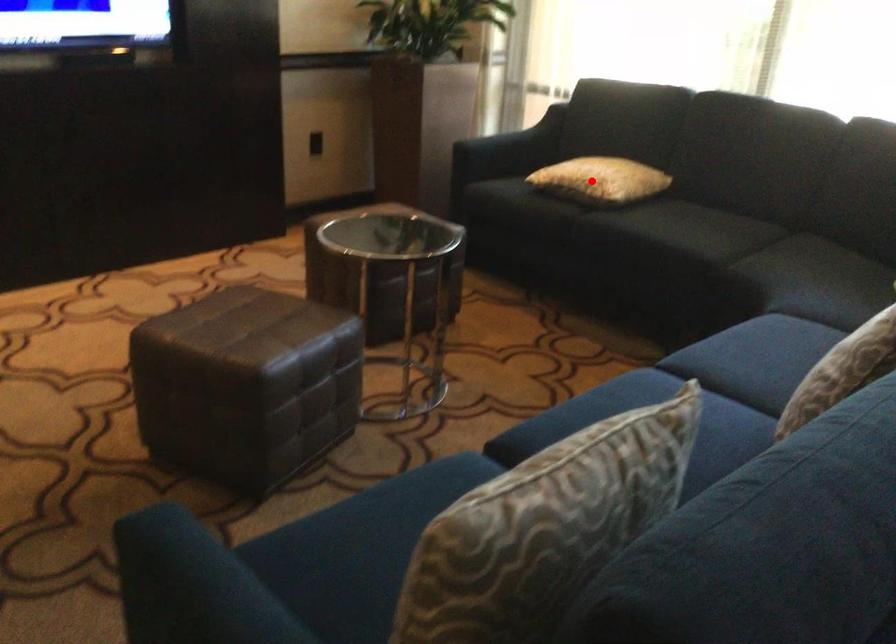
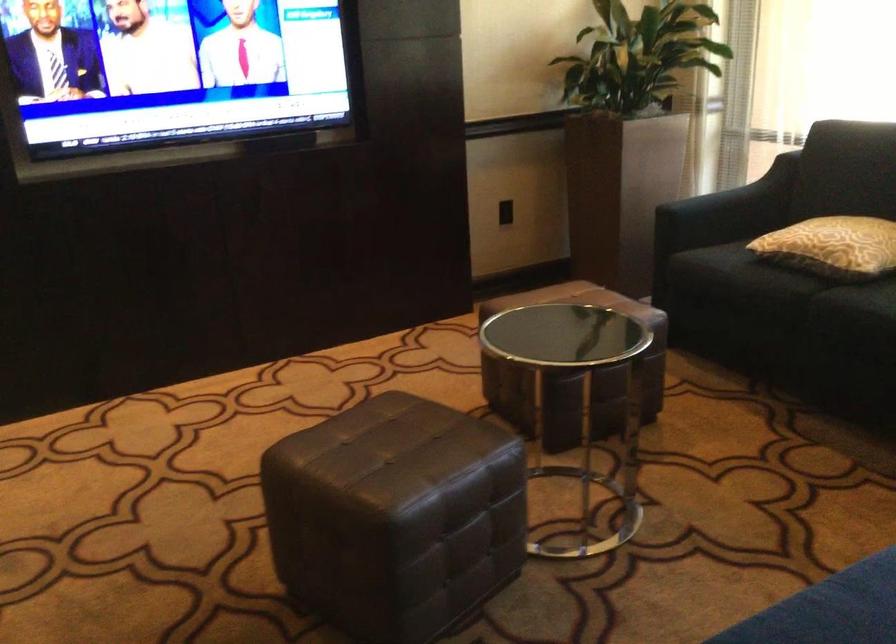
Question: I am providing you with two images of the same scene from different viewpoints. Given a red point in image1, look at the same physical point in image2. Is it:

Choices:
 (A) Closer to the viewpoint
 (B) Farther from the viewpoint

Answer: (A)